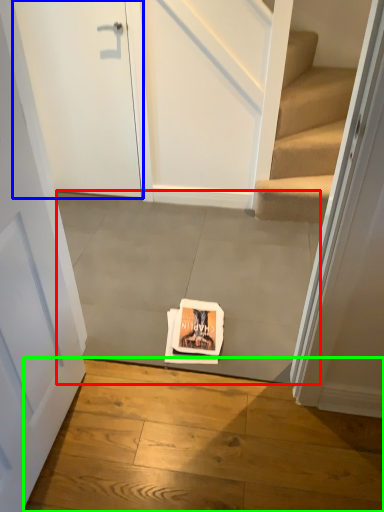
Question: Based on their relative distances, which object is farther from concrete (highlighted by a red box)? Choose from door (highlighted by a blue box) and concrete (highlighted by a green box).

Choices:
 (A) door
 (B) concrete

Answer: (A)